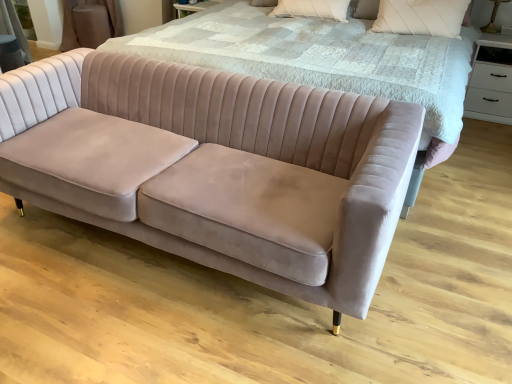
Question: Can you confirm if matte gold table lamp at upper right is positioned to the left of white textured pillow at upper center, positioned as the second pillow in right-to-left order?

Choices:
 (A) no
 (B) yes

Answer: (A)

Question: From the image's perspective, would you say matte gold table lamp at upper right is shown under white textured pillow at upper center, positioned as the 1th pillow in left-to-right order?

Choices:
 (A) yes
 (B) no

Answer: (A)

Question: From a real-world perspective, is matte gold table lamp at upper right on top of white textured pillow at upper center, positioned as the 1th pillow in left-to-right order?

Choices:
 (A) yes
 (B) no

Answer: (A)

Question: Can you confirm if matte gold table lamp at upper right is thinner than white textured pillow at upper center, positioned as the second pillow in right-to-left order?

Choices:
 (A) no
 (B) yes

Answer: (B)

Question: Is matte gold table lamp at upper right further to the viewer compared to white textured pillow at upper center, positioned as the second pillow in right-to-left order?

Choices:
 (A) no
 (B) yes

Answer: (B)

Question: Considering the relative sizes of matte gold table lamp at upper right and white textured pillow at upper center, positioned as the second pillow in right-to-left order, in the image provided, is matte gold table lamp at upper right bigger than white textured pillow at upper center, positioned as the second pillow in right-to-left order,?

Choices:
 (A) no
 (B) yes

Answer: (A)

Question: Is velvet bed at center looking in the opposite direction of velvet beige couch at lower left?

Choices:
 (A) no
 (B) yes

Answer: (A)

Question: Is velvet bed at center at the left side of velvet beige couch at lower left?

Choices:
 (A) yes
 (B) no

Answer: (B)

Question: Can you confirm if velvet bed at center is smaller than velvet beige couch at lower left?

Choices:
 (A) yes
 (B) no

Answer: (B)

Question: Is velvet bed at center aimed at velvet beige couch at lower left?

Choices:
 (A) no
 (B) yes

Answer: (B)

Question: Considering the relative sizes of velvet bed at center and velvet beige couch at lower left in the image provided, is velvet bed at center thinner than velvet beige couch at lower left?

Choices:
 (A) yes
 (B) no

Answer: (B)

Question: Can you confirm if velvet bed at center is wider than velvet beige couch at lower left?

Choices:
 (A) no
 (B) yes

Answer: (B)

Question: Does white glossy drawer at upper right turn towards matte gold table lamp at upper right?

Choices:
 (A) yes
 (B) no

Answer: (B)